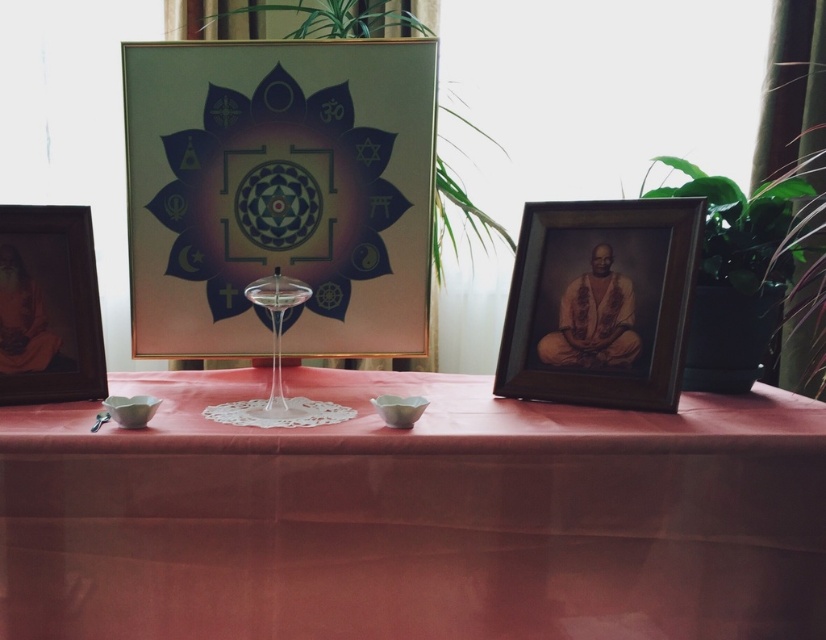
Question: Can you confirm if wooden framed portrait at right is positioned below matte wooden picture frame at left?

Choices:
 (A) yes
 (B) no

Answer: (B)

Question: Does smooth glossy tablecloth at center lie in front of matte wooden picture frame at left?

Choices:
 (A) no
 (B) yes

Answer: (B)

Question: Does wooden framed portrait at right lie behind transparent glass wine glass at center?

Choices:
 (A) no
 (B) yes

Answer: (B)

Question: Which of the following is the farthest from the observer?

Choices:
 (A) (x=274, y=412)
 (B) (x=499, y=230)

Answer: (B)

Question: Considering the real-world distances, which object is farthest from the matte wooden picture frame at left?

Choices:
 (A) wooden framed portrait at right
 (B) smooth glossy tablecloth at center

Answer: (A)

Question: Which object is the farthest from the matte wooden picture frame at left?

Choices:
 (A) transparent glass wine glass at center
 (B) smooth glossy tablecloth at center
 (C) green leafy plant at upper center

Answer: (C)